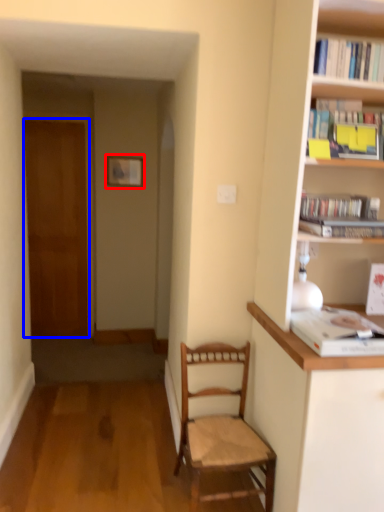
Question: Which of the following is the farthest to the observer, picture frame (highlighted by a red box) or door (highlighted by a blue box)?

Choices:
 (A) picture frame
 (B) door

Answer: (B)